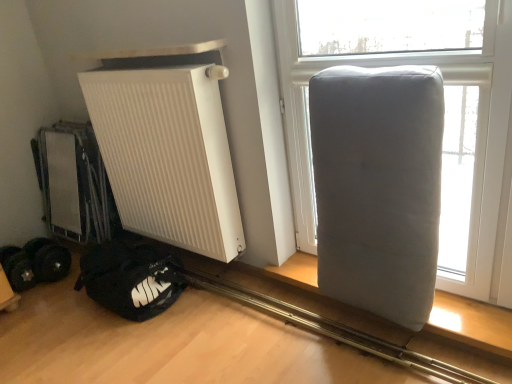
The image size is (512, 384). In order to click on vacant region above white matte radiator at left (from a real-world perspective) in this screenshot , I will do `click(144, 58)`.